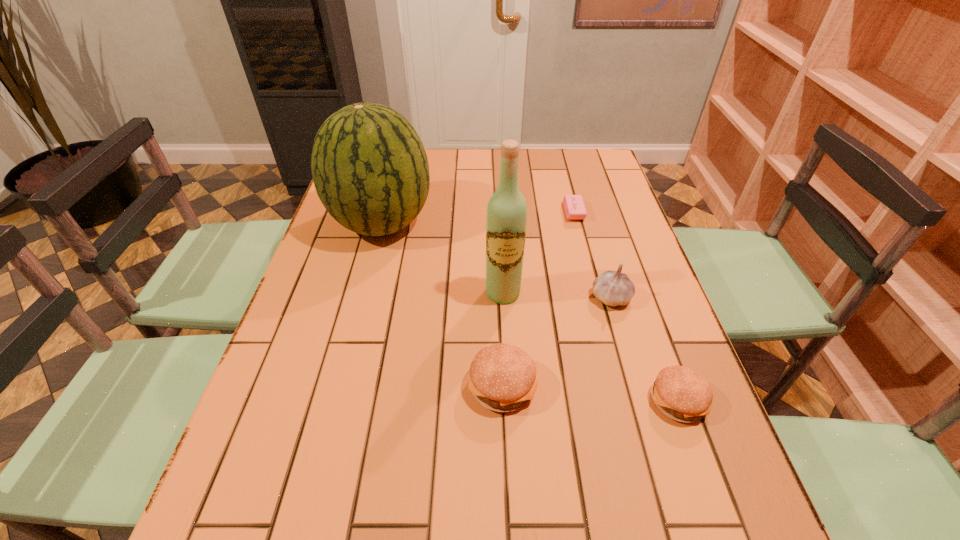
Locate an element on the screen. The height and width of the screenshot is (540, 960). empty space between the shorter hamburger and the third tallest object is located at coordinates (644, 349).

Identify the location of free spot between the shorter hamburger and the wine bottle. This screenshot has height=540, width=960. (590, 347).

I want to click on vacant area between the wine bottle and the left hamburger, so click(x=503, y=339).

You are a GUI agent. You are given a task and a screenshot of the screen. Output one action in this format:
    pyautogui.click(x=<x>, y=<y>)
    Task: Click on the free space between the left hamburger and the garlic
    Image resolution: width=960 pixels, height=540 pixels.
    Given the screenshot: What is the action you would take?
    pyautogui.click(x=557, y=341)

At what (x,y) coordinates should I click in order to perform the action: click on object that can be found as the fourth closest to the second shortest object. Please return your answer as a coordinate pair (x, y). This screenshot has width=960, height=540. Looking at the image, I should click on (574, 206).

Where is `object that stands as the closest to the wine bottle`? This screenshot has height=540, width=960. object that stands as the closest to the wine bottle is located at coordinates (502, 378).

Find the location of a particular element. vacant space that satisfies the following two spatial constraints: 1. on the front-facing side of the third tallest object; 2. on the left side of the wine bottle is located at coordinates (503, 298).

Identify the location of free space that satisfies the following two spatial constraints: 1. on the back side of the eraser; 2. on the left side of the third shortest object. This screenshot has height=540, width=960. (495, 212).

Locate an element on the screen. blank space that satisfies the following two spatial constraints: 1. on the back side of the shortest object; 2. on the right side of the third shortest object is located at coordinates (495, 212).